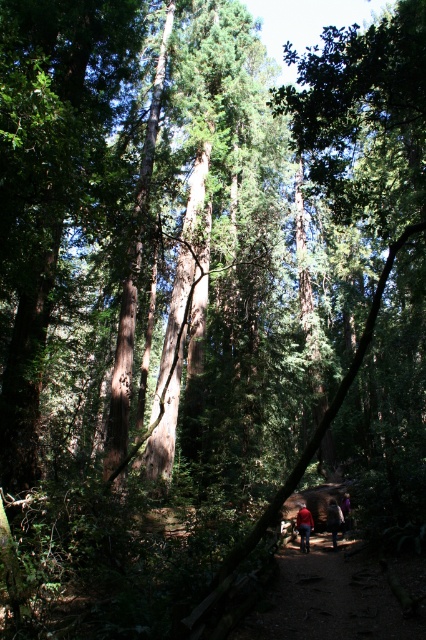
Looking at this image, you are a hiker trying to decide which jacket to take for a rainy day hike. You see the red matte jacket at center and the dark brown leather jacket at center in the forest scene. Which jacket appears to be more suitable for rain based on their material descriptions?

The dark brown leather jacket at center is more suitable for rain as leather provides better water resistance compared to the matte jacket material.

You are a hiker who has lost your jacket. You remember that your red matte jacket at center was last seen near the dirt path in the forest. Based on the scene, where would you look for it?

The red matte jacket at center is located at point (304, 525), which is near the dirt path in the forest. You should search the area along the dirt path where the wooden fence is located.

You are a hiker carrying a backpack and see the dark brown leather jacket at center and the purple fabric at center on the forest path. If your backpack is 1.5 meters long, can you place it between them without overlapping?

The distance between the dark brown leather jacket at center and the purple fabric at center is 1.42 meters. Since your backpack is 1.5 meters long, it cannot fit between them without overlapping.